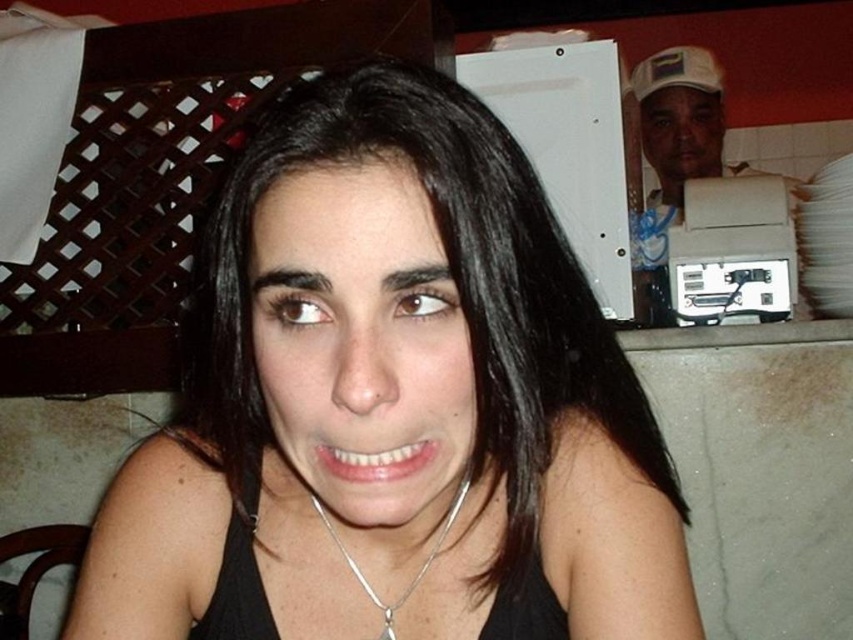
You are taking a photo of the scene and want to focus on both the point at (512, 220) and the point at (643, 147). Since you know one is closer than the other, which point should you focus on first to ensure both are in sharp focus?

You should focus on point (512, 220) first because it is closer to the camera than point (643, 147). This ensures the closer point is in focus, and the farther point will also be sharp due to the depth of field.

You are a fashion designer observing the person in the scene. You need to determine which item is more visible to you between the black matte tank top at center and the silver chain at center. Which one would you say is more visible?

The black matte tank top at center is closer to the viewer than the silver chain at center, so the black matte tank top at center is more visible.